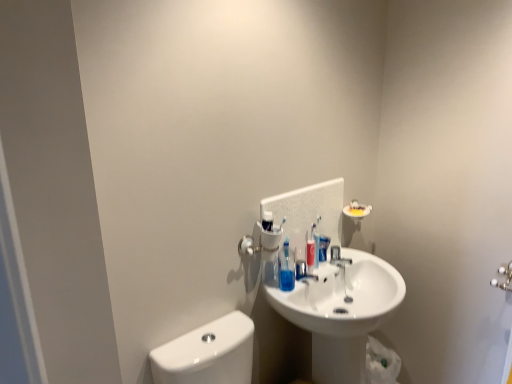
The width and height of the screenshot is (512, 384). What do you see at coordinates (323, 247) in the screenshot?
I see `blue glossy mouthwash at center` at bounding box center [323, 247].

Locate an element on the screen. The height and width of the screenshot is (384, 512). white glossy sink at center is located at coordinates (338, 315).

The width and height of the screenshot is (512, 384). Find the location of `blue glossy mouthwash at center`. blue glossy mouthwash at center is located at coordinates (323, 247).

Which object is thinner, blue glossy mouthwash at center or white glossy sink at center?

With smaller width is blue glossy mouthwash at center.

From a real-world perspective, is blue glossy mouthwash at center positioned over white glossy sink at center based on gravity?

Correct, in the physical world, blue glossy mouthwash at center is higher than white glossy sink at center.

Measure the distance from blue glossy mouthwash at center to white glossy sink at center.

blue glossy mouthwash at center is 11.85 inches away from white glossy sink at center.

From the image's perspective, which one is positioned higher, blue glossy mouthwash at center or white glossy sink at center?

blue glossy mouthwash at center, from the image's perspective.

From a real-world perspective, is satin nickel faucet at center physically above white glossy sink at center?

Yes, from a real-world perspective, satin nickel faucet at center is above white glossy sink at center.

Is satin nickel faucet at center to the left or to the right of white glossy sink at center in the image?

Based on their positions, satin nickel faucet at center is located to the left of white glossy sink at center.

Between point (331, 260) and point (366, 332), which one is positioned in front?

The point (366, 332) is more forward.

Is satin nickel faucet at center oriented away from white glossy sink at center?

Yes, satin nickel faucet at center is facing away from white glossy sink at center.

Based on the photo, considering the sizes of objects translucent plastic soap dispenser at center and blue glossy mouthwash at center in the image provided, who is bigger, translucent plastic soap dispenser at center or blue glossy mouthwash at center?

With larger size is translucent plastic soap dispenser at center.

Can you confirm if translucent plastic soap dispenser at center is positioned to the left of blue glossy mouthwash at center?

Correct, you'll find translucent plastic soap dispenser at center to the left of blue glossy mouthwash at center.

Are translucent plastic soap dispenser at center and blue glossy mouthwash at center beside each other?

No, translucent plastic soap dispenser at center is not touching blue glossy mouthwash at center.

What's the angular difference between translucent plastic soap dispenser at center and blue glossy mouthwash at center's facing directions?

4.17 degrees separate the facing orientations of translucent plastic soap dispenser at center and blue glossy mouthwash at center.

Is satin nickel faucet at center positioned beyond the bounds of translucent plastic soap dispenser at center?

satin nickel faucet at center lies outside translucent plastic soap dispenser at center's area.

Visually, is satin nickel faucet at center positioned to the left or to the right of translucent plastic soap dispenser at center?

Clearly, satin nickel faucet at center is on the right of translucent plastic soap dispenser at center in the image.

Considering the positions of point (330, 259) and point (292, 271), is point (330, 259) closer or farther from the camera than point (292, 271)?

Clearly, point (330, 259) is more distant from the camera than point (292, 271).

Between satin nickel faucet at center and translucent plastic soap dispenser at center, which one has larger size?

translucent plastic soap dispenser at center is bigger.

Does blue glossy mouthwash at center turn towards translucent plastic soap dispenser at center?

No.

Can you see blue glossy mouthwash at center touching translucent plastic soap dispenser at center?

blue glossy mouthwash at center and translucent plastic soap dispenser at center are not in contact.

Would you say blue glossy mouthwash at center contains translucent plastic soap dispenser at center?

No, translucent plastic soap dispenser at center is not surrounded by blue glossy mouthwash at center.

Between blue glossy mouthwash at center and translucent plastic soap dispenser at center, which one is positioned in front?

translucent plastic soap dispenser at center.

This screenshot has height=384, width=512. I want to click on sink in front of the translucent plastic soap dispenser at center, so click(x=338, y=315).

Looking at their sizes, would you say white glossy sink at center is wider or thinner than translucent plastic soap dispenser at center?

In the image, white glossy sink at center appears to be wider than translucent plastic soap dispenser at center.

Is white glossy sink at center next to translucent plastic soap dispenser at center?

white glossy sink at center and translucent plastic soap dispenser at center are not in contact.

Which is in front, point (387, 294) or point (289, 289)?

The point (289, 289) is in front.

Looking at this image, is translucent plastic soap dispenser at center oriented towards white glossy sink at center?

No, translucent plastic soap dispenser at center is not aimed at white glossy sink at center.

In the scene shown: Is translucent plastic soap dispenser at center not close to white glossy sink at center?

No, translucent plastic soap dispenser at center is in close proximity to white glossy sink at center.

Between translucent plastic soap dispenser at center and white glossy sink at center, which one has larger size?

white glossy sink at center.

From the image's perspective, which is above, translucent plastic soap dispenser at center or white glossy sink at center?

From the image's view, translucent plastic soap dispenser at center is above.

What are the coordinates of `sink that appears in front of the blue glossy mouthwash at center` in the screenshot? It's located at (338, 315).

Locate an element on the screen. The height and width of the screenshot is (384, 512). plumbing fixture located above the white glossy sink at center (from a real-world perspective) is located at coordinates (338, 257).

Estimate the real-world distances between objects in this image. Which object is further from satin nickel faucet at center, white glossy sink at center or blue glossy mouthwash at center?

white glossy sink at center.

From the image, which object appears to be nearer to blue glossy mouthwash at center, translucent plastic soap dispenser at center or white glossy sink at center?

translucent plastic soap dispenser at center.

Which object lies further to the anchor point satin nickel faucet at center, translucent plastic soap dispenser at center or white glossy sink at center?

white glossy sink at center is positioned further to the anchor satin nickel faucet at center.

Estimate the real-world distances between objects in this image. Which object is further from blue glossy mouthwash at center, white glossy sink at center or satin nickel faucet at center?

white glossy sink at center is positioned further to the anchor blue glossy mouthwash at center.

Consider the image. Which object lies further to the anchor point white glossy sink at center, translucent plastic soap dispenser at center or satin nickel faucet at center?

satin nickel faucet at center lies further to white glossy sink at center than the other object.

From the image, which object appears to be farther from translucent plastic soap dispenser at center, satin nickel faucet at center or white glossy sink at center?

satin nickel faucet at center is further to translucent plastic soap dispenser at center.

Which object lies nearer to the anchor point white glossy sink at center, satin nickel faucet at center or translucent plastic soap dispenser at center?

translucent plastic soap dispenser at center.

Which object lies nearer to the anchor point translucent plastic soap dispenser at center, white glossy sink at center or blue glossy mouthwash at center?

blue glossy mouthwash at center.

Identify the location of plumbing fixture between translucent plastic soap dispenser at center and white glossy sink at center vertically. (338, 257).

The image size is (512, 384). In order to click on toiletry that lies between blue glossy mouthwash at center and white glossy sink at center from top to bottom in this screenshot , I will do `click(286, 269)`.

What are the coordinates of `mouthwash situated between translucent plastic soap dispenser at center and satin nickel faucet at center from left to right` in the screenshot? It's located at (323, 247).

Image resolution: width=512 pixels, height=384 pixels. I want to click on plumbing fixture between blue glossy mouthwash at center and white glossy sink at center in the vertical direction, so 338,257.